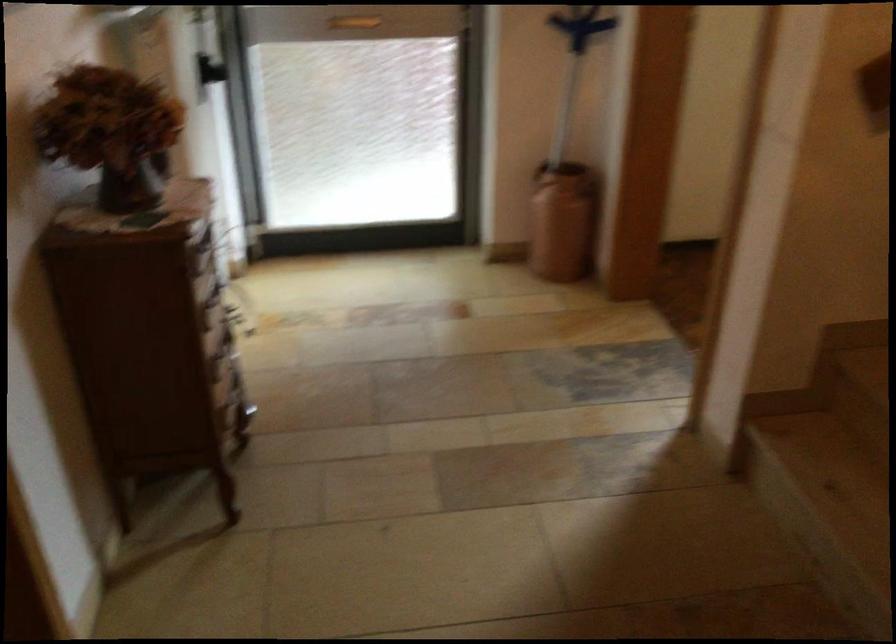
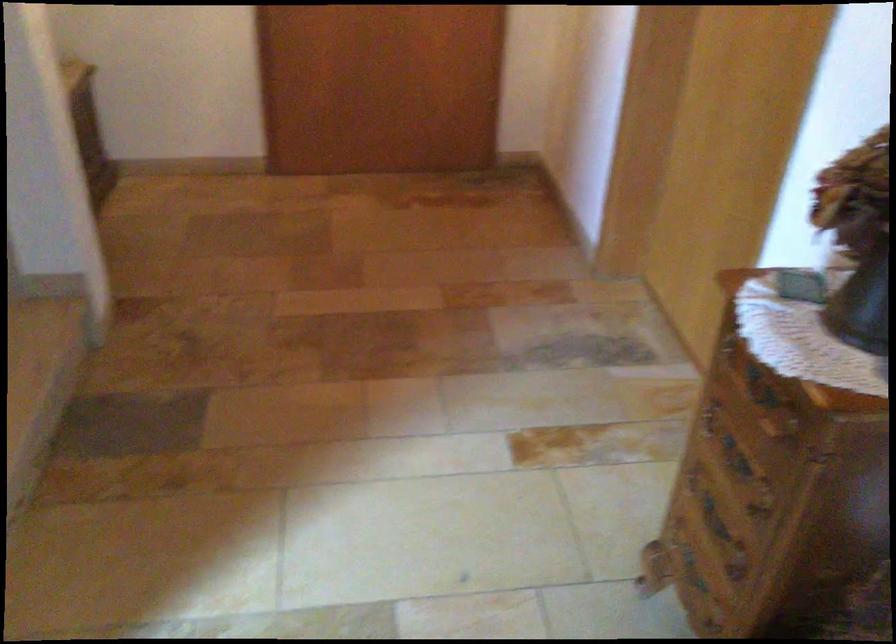
Find the pixel in the second image that matches (x=229, y=442) in the first image.

(693, 571)